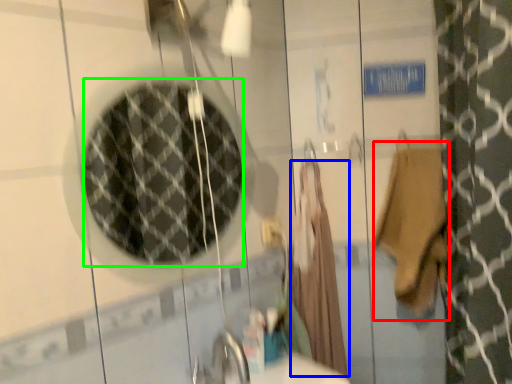
Question: Estimate the real-world distances between objects in this image. Which object is closer to bath towel (highlighted by a red box), robe (highlighted by a blue box) or mirror (highlighted by a green box)?

Choices:
 (A) robe
 (B) mirror

Answer: (A)